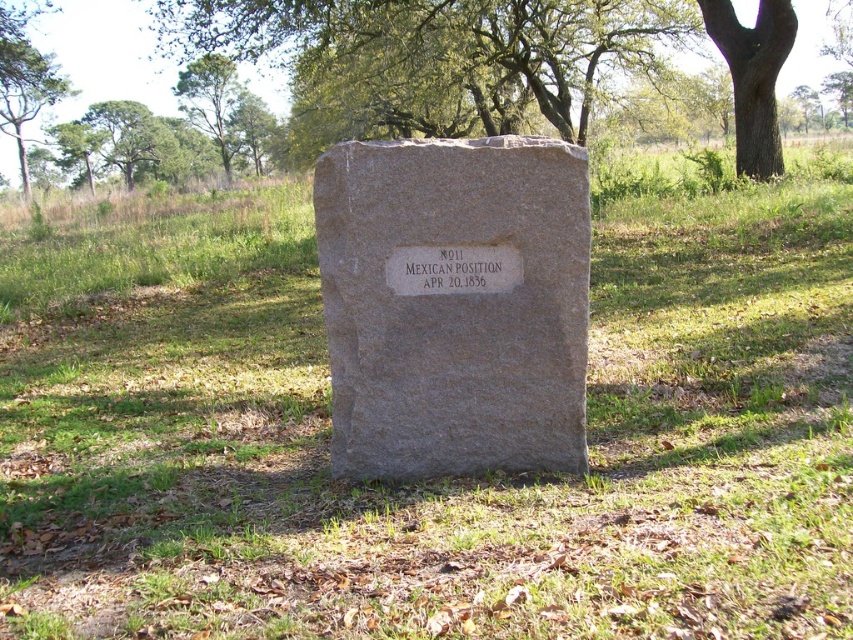
You are standing in front of the gray stone gravestone at center and looking towards the smooth brown bark at upper right. Which object is closer to you?

The gray stone gravestone at center is closer to you than the smooth brown bark at upper right.

You are a photographer taking a picture of the monument. You notice two points marked in the image. Which point is closer to your camera lens, point 1 at coordinates point (209,65) or point 2 at coordinates point (397,282)?

Point 2 at coordinates point (397,282) is closer to the camera lens because it is less further away than point 1 at coordinates point (209,65).